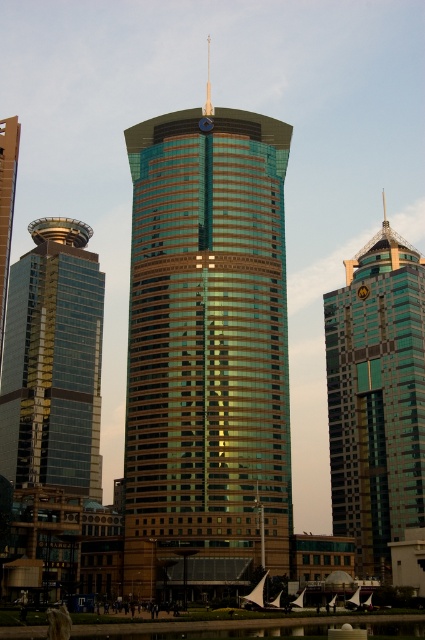
Question: Which of these objects is positioned farthest from the shiny glass skyscraper at left?

Choices:
 (A) green glass skyscraper at upper right
 (B) green glassy tower at center

Answer: (B)

Question: Which is farther from the green glass skyscraper at upper right?

Choices:
 (A) shiny glass skyscraper at left
 (B) green glassy tower at center

Answer: (A)

Question: Which of the following is the closest to the observer?

Choices:
 (A) (274, 381)
 (B) (385, 291)

Answer: (A)

Question: Does green glassy tower at center appear on the right side of shiny glass skyscraper at left?

Choices:
 (A) yes
 (B) no

Answer: (A)

Question: Is green glass skyscraper at upper right wider than shiny glass skyscraper at left?

Choices:
 (A) no
 (B) yes

Answer: (B)

Question: Is green glassy tower at center to the left of green glass skyscraper at upper right from the viewer's perspective?

Choices:
 (A) no
 (B) yes

Answer: (B)